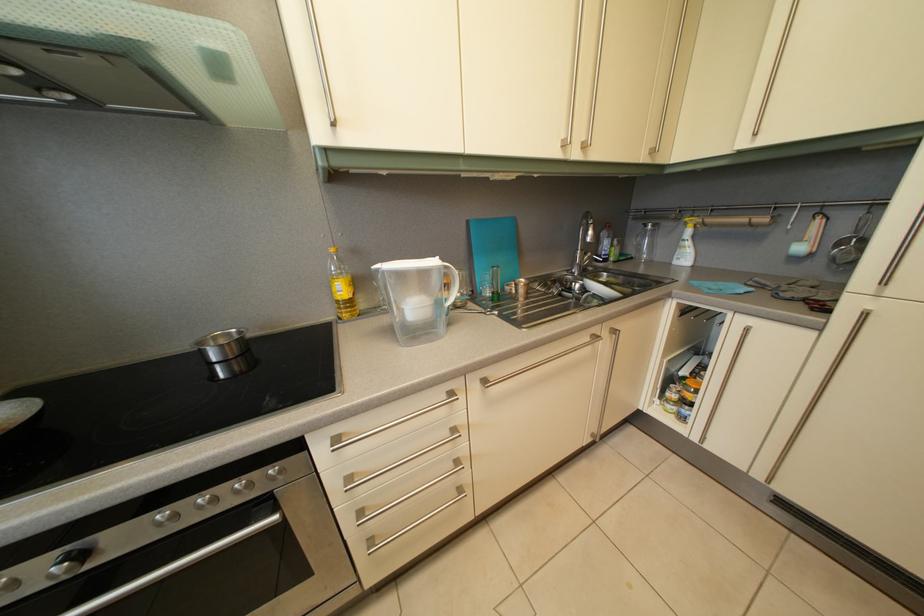
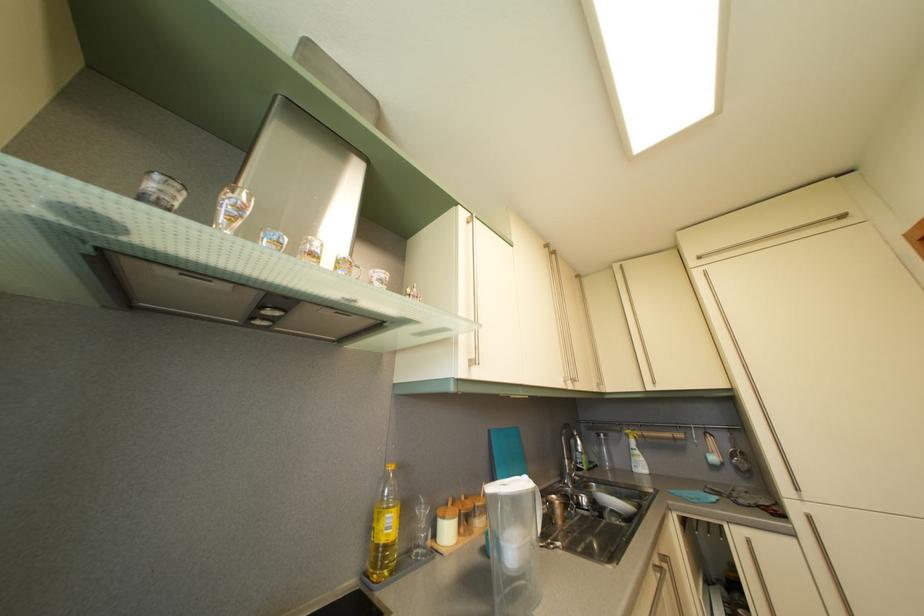
Find the pixel in the second image that matches (x=476, y=229) in the first image.

(497, 439)